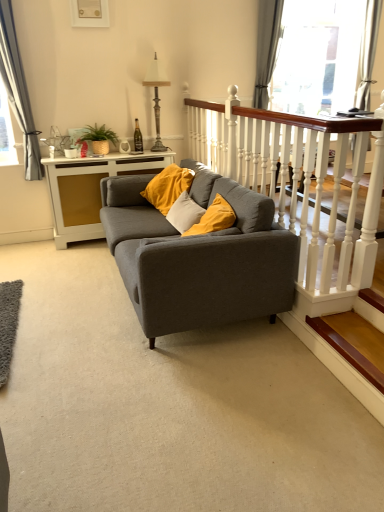
Question: Considering the positions of matte gray couch at center and matte white picture frame at upper center in the image, is matte gray couch at center wider or thinner than matte white picture frame at upper center?

Choices:
 (A) wide
 (B) thin

Answer: (A)

Question: Do you think matte gray couch at center is within matte white picture frame at upper center, or outside of it?

Choices:
 (A) inside
 (B) outside

Answer: (B)

Question: Considering the real-world distances, which object is farthest from the antique bronze lamp at upper center?

Choices:
 (A) green woven basket at upper left
 (B) matte white picture frame at upper center
 (C) matte gray couch at center
 (D) white glossy side table at center
 (E) gray fabric curtain at left, which is the third curtain in right-to-left order

Answer: (C)

Question: Which of these objects is positioned farthest from the gray fabric curtain at left, which is the third curtain in right-to-left order?

Choices:
 (A) silky white curtain at upper right, the 3th curtain when ordered from left to right
 (B) antique bronze lamp at upper center
 (C) gray fabric curtain at upper right, the 2th curtain positioned from the left
 (D) wooden at lower right
 (E) green woven basket at upper left

Answer: (A)